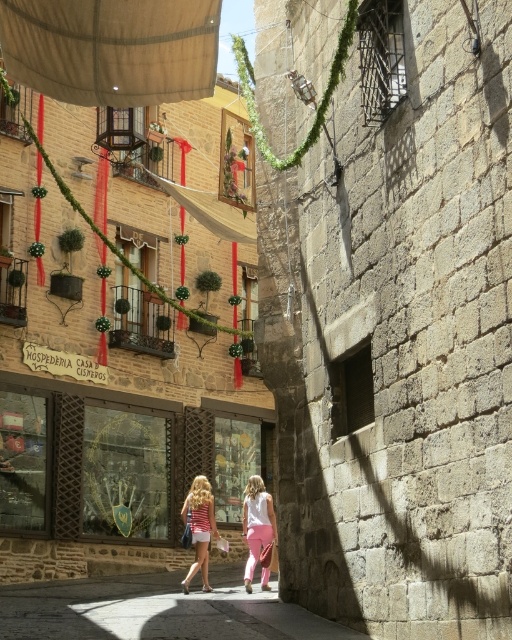
Does beige canvas awning at upper center have a greater width compared to matte pink pants at center?

Indeed, beige canvas awning at upper center has a greater width compared to matte pink pants at center.

How far apart are beige canvas awning at upper center and matte pink pants at center?

A distance of 67.44 feet exists between beige canvas awning at upper center and matte pink pants at center.

What do you see at coordinates (112, 49) in the screenshot? I see `beige canvas awning at upper center` at bounding box center [112, 49].

Image resolution: width=512 pixels, height=640 pixels. In order to click on beige canvas awning at upper center in this screenshot , I will do `click(112, 49)`.

Which is in front, point (245, 486) or point (206, 529)?

Positioned in front is point (206, 529).

Who is more distant from viewer, (251,552) or (204,545)?

The point (204,545) is more distant.

Does point (254, 525) come in front of point (195, 483)?

Yes, it is in front of point (195, 483).

Image resolution: width=512 pixels, height=640 pixels. Identify the location of matte pink pants at center. (257, 524).

Which is below, beige canvas awning at upper center or striped fabric dress at center?

striped fabric dress at center

Which of these two, beige canvas awning at upper center or striped fabric dress at center, stands taller?

Standing taller between the two is striped fabric dress at center.

Between point (18, 40) and point (195, 538), which one is positioned in front?

Positioned in front is point (18, 40).

Find the location of a particular element. This screenshot has height=640, width=512. beige canvas awning at upper center is located at coordinates (112, 49).